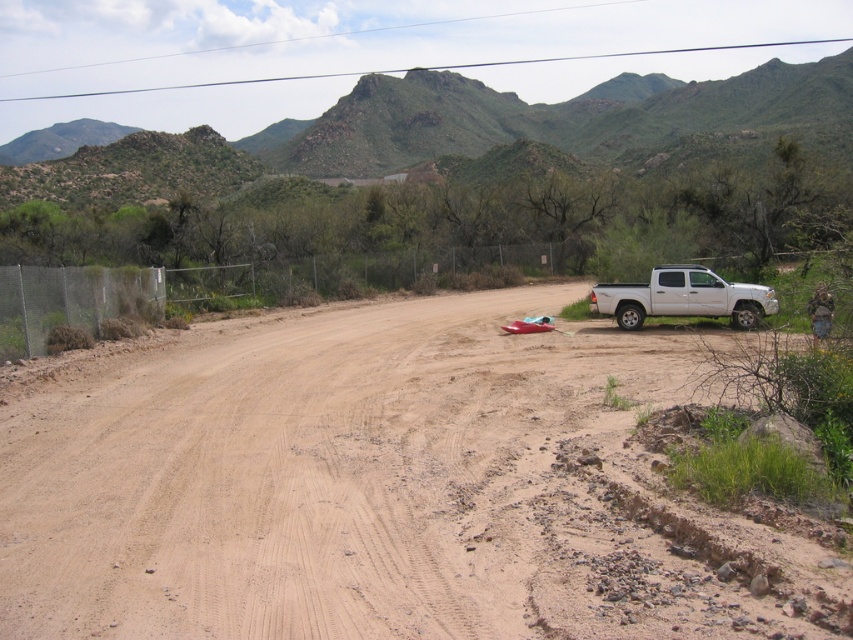
You are standing at the point marked by point (381, 486), which is the dull brown dirt at center. You want to walk towards the white pickup truck parked on the right side of the road. Which direction should you face to walk directly towards the truck?

You should face towards the right side of the road to walk directly towards the white pickup truck parked on the right side of the road since the truck is located on the right side of the road relative to your position at the dull brown dirt at center.

You are a hiker planning to walk from the dull brown dirt at center to the green textured mountain at upper center. Which direction should you head to reach the mountain?

The dull brown dirt at center is positioned on the left side of green textured mountain at upper center, so you should head to the right to reach the mountain.